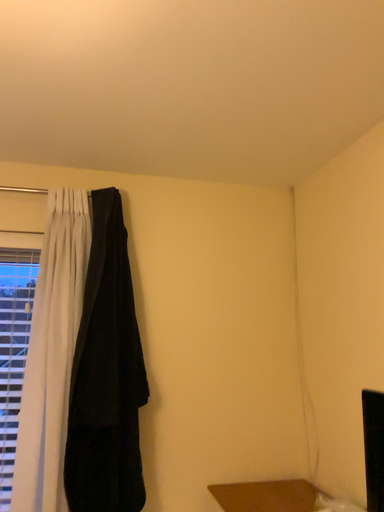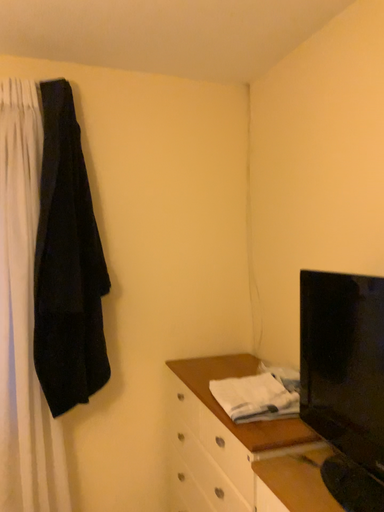
Question: Which way did the camera rotate in the video?

Choices:
 (A) rotated upward
 (B) rotated downward

Answer: (B)